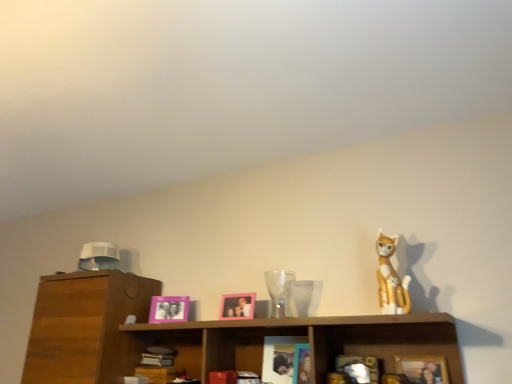
Question: Does transparent glass vase at center have a lesser width compared to pink plastic picture frame at center, the first picture frame when ordered from left to right?

Choices:
 (A) no
 (B) yes

Answer: (A)

Question: Is transparent glass vase at center further to the viewer compared to pink plastic picture frame at center, which is the third picture frame in front-to-back order?

Choices:
 (A) no
 (B) yes

Answer: (A)

Question: Is transparent glass vase at center not within pink plastic picture frame at center, which is the third picture frame in front-to-back order?

Choices:
 (A) no
 (B) yes

Answer: (B)

Question: From a real-world perspective, is transparent glass vase at center physically below pink plastic picture frame at center, which is the third picture frame in front-to-back order?

Choices:
 (A) no
 (B) yes

Answer: (A)

Question: Is transparent glass vase at center positioned in front of pink plastic picture frame at center, the third picture frame positioned from the right?

Choices:
 (A) no
 (B) yes

Answer: (B)

Question: Do you think pink plastic picture frame at center, which ranks as the second picture frame in right-to-left order, is within wooden shelf at center, or outside of it?

Choices:
 (A) inside
 (B) outside

Answer: (B)

Question: From the image's perspective, is pink plastic picture frame at center, the second picture frame when ordered from left to right, above or below wooden shelf at center?

Choices:
 (A) above
 (B) below

Answer: (A)

Question: Is point (224, 306) closer or farther from the camera than point (141, 340)?

Choices:
 (A) closer
 (B) farther

Answer: (A)

Question: Is pink plastic picture frame at center, which ranks as the second picture frame in right-to-left order, wider or thinner than wooden shelf at center?

Choices:
 (A) wide
 (B) thin

Answer: (B)

Question: Would you say matte pink picture frame at center, arranged as the third picture frame when viewed from the left, is to the left or to the right of pink plastic picture frame at center, which appears as the 2th picture frame when viewed from the front, in the picture?

Choices:
 (A) left
 (B) right

Answer: (B)

Question: Does point (426, 365) appear closer or farther from the camera than point (241, 309)?

Choices:
 (A) farther
 (B) closer

Answer: (B)

Question: Considering the positions of matte pink picture frame at center, arranged as the third picture frame when viewed from the left, and pink plastic picture frame at center, which appears as the 2th picture frame when viewed from the front, in the image, is matte pink picture frame at center, arranged as the third picture frame when viewed from the left, bigger or smaller than pink plastic picture frame at center, which appears as the 2th picture frame when viewed from the front,?

Choices:
 (A) small
 (B) big

Answer: (B)

Question: Is matte pink picture frame at center, arranged as the third picture frame when viewed from the left, situated inside pink plastic picture frame at center, which ranks as the second picture frame in right-to-left order, or outside?

Choices:
 (A) inside
 (B) outside

Answer: (B)

Question: In the image, is pink plastic picture frame at center, the 1th picture frame from the back, positioned in front of or behind pink plastic picture frame at center, which ranks as the second picture frame in right-to-left order?

Choices:
 (A) front
 (B) behind

Answer: (B)

Question: Would you say pink plastic picture frame at center, the 1th picture frame from the back, is to the left or to the right of pink plastic picture frame at center, the second picture frame when ordered from left to right, in the picture?

Choices:
 (A) left
 (B) right

Answer: (A)